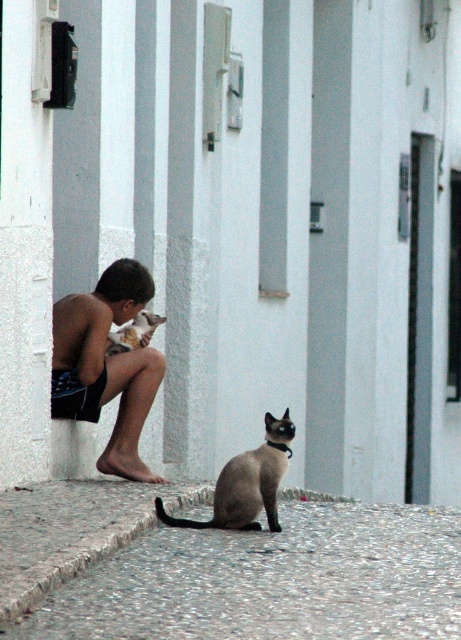
Between gray gravel at lower center and gray concrete curb at lower left, which one has more height?

gray concrete curb at lower left is taller.

Which is behind, point (394, 548) or point (178, 506)?

The point (178, 506) is behind.

At what (x,y) coordinates should I click in order to perform the action: click on gray gravel at lower center. Please return your answer as a coordinate pair (x, y). This screenshot has width=461, height=640. Looking at the image, I should click on (271, 580).

Can you confirm if smokey gray fur at lower center is smaller than brown fur cat at left?

No, smokey gray fur at lower center is not smaller than brown fur cat at left.

Is point (231, 513) closer to camera compared to point (148, 321)?

Yes, it is.

You are a GUI agent. You are given a task and a screenshot of the screen. Output one action in this format:
    pyautogui.click(x=<x>, y=<y>)
    Task: Click on the smokey gray fur at lower center
    The height and width of the screenshot is (640, 461).
    Given the screenshot: What is the action you would take?
    pyautogui.click(x=247, y=483)

Is the position of brown skin boy at left more distant than that of smokey gray fur at lower center?

Yes, it is.

The image size is (461, 640). Describe the element at coordinates (106, 364) in the screenshot. I see `brown skin boy at left` at that location.

Where is `brown skin boy at left`? brown skin boy at left is located at coordinates (106, 364).